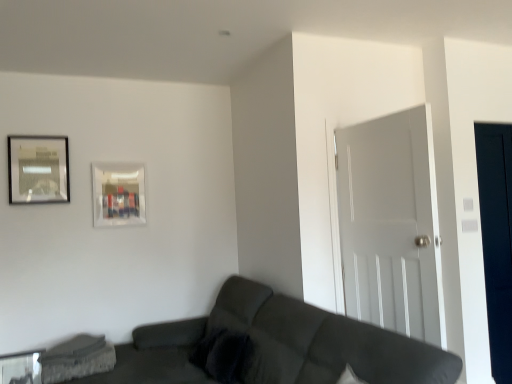
Question: Does concrete textured swivel chair at lower left have a lesser width compared to dark gray fabric couch at lower center?

Choices:
 (A) no
 (B) yes

Answer: (B)

Question: Considering the relative sizes of concrete textured swivel chair at lower left and dark gray fabric couch at lower center in the image provided, is concrete textured swivel chair at lower left smaller than dark gray fabric couch at lower center?

Choices:
 (A) no
 (B) yes

Answer: (B)

Question: Can you confirm if concrete textured swivel chair at lower left is shorter than dark gray fabric couch at lower center?

Choices:
 (A) yes
 (B) no

Answer: (A)

Question: From a real-world perspective, is concrete textured swivel chair at lower left over dark gray fabric couch at lower center?

Choices:
 (A) no
 (B) yes

Answer: (A)

Question: Is concrete textured swivel chair at lower left at the right side of dark gray fabric couch at lower center?

Choices:
 (A) yes
 (B) no

Answer: (B)

Question: From the image's perspective, is transparent glass table at lower left located above or below dark gray fabric couch at lower center?

Choices:
 (A) above
 (B) below

Answer: (B)

Question: Based on their sizes in the image, would you say transparent glass table at lower left is bigger or smaller than dark gray fabric couch at lower center?

Choices:
 (A) small
 (B) big

Answer: (A)

Question: Is transparent glass table at lower left in front of or behind dark gray fabric couch at lower center in the image?

Choices:
 (A) front
 (B) behind

Answer: (B)

Question: From a real-world perspective, relative to dark gray fabric couch at lower center, is transparent glass table at lower left vertically above or below?

Choices:
 (A) above
 (B) below

Answer: (B)

Question: Based on their sizes in the image, would you say metallic silver picture frame at upper left, placed as the 2th picture frame when sorted from right to left, is bigger or smaller than transparent glass door at right?

Choices:
 (A) big
 (B) small

Answer: (B)

Question: Considering the positions of metallic silver picture frame at upper left, marked as the first picture frame in a left-to-right arrangement, and transparent glass door at right in the image, is metallic silver picture frame at upper left, marked as the first picture frame in a left-to-right arrangement, wider or thinner than transparent glass door at right?

Choices:
 (A) wide
 (B) thin

Answer: (A)

Question: Do you think metallic silver picture frame at upper left, marked as the first picture frame in a left-to-right arrangement, is within transparent glass door at right, or outside of it?

Choices:
 (A) inside
 (B) outside

Answer: (B)

Question: From the image's perspective, is metallic silver picture frame at upper left, acting as the 1th picture frame starting from the front, located above or below transparent glass door at right?

Choices:
 (A) above
 (B) below

Answer: (A)

Question: Considering the positions of dark gray fabric couch at lower center and concrete textured swivel chair at lower left in the image, is dark gray fabric couch at lower center taller or shorter than concrete textured swivel chair at lower left?

Choices:
 (A) tall
 (B) short

Answer: (A)

Question: Do you think dark gray fabric couch at lower center is within concrete textured swivel chair at lower left, or outside of it?

Choices:
 (A) inside
 (B) outside

Answer: (B)